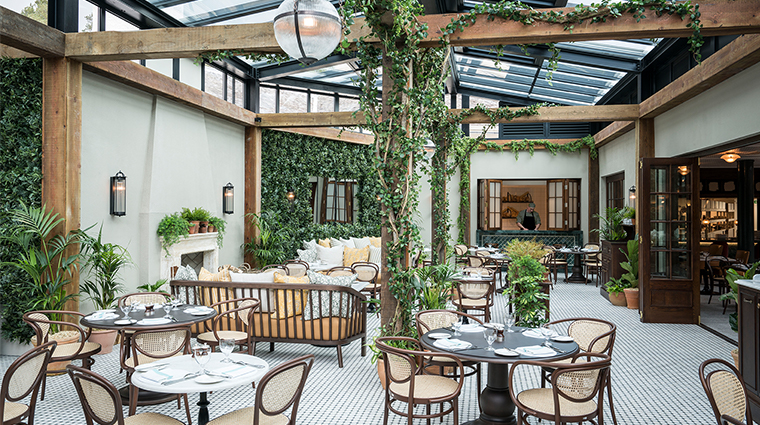
Where is `dresser`? This screenshot has width=760, height=425. dresser is located at coordinates (505, 216).